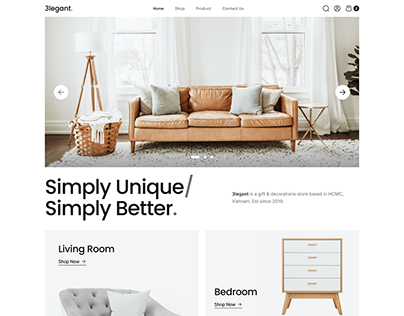
I want to click on area rug, so click(x=236, y=157).